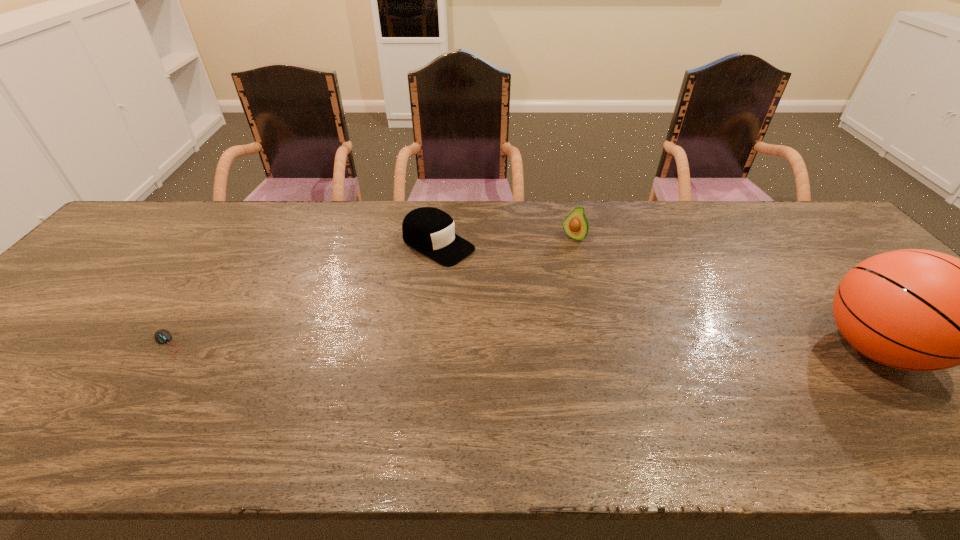
Locate an element on the screen. free space at the near right corner is located at coordinates (949, 379).

Identify the location of free space between the cap and the second tallest object. The image size is (960, 540). (506, 241).

At what (x,y) coordinates should I click in order to perform the action: click on free spot between the third shortest object and the third tallest object. Please return your answer as a coordinate pair (x, y). The image size is (960, 540). Looking at the image, I should click on (506, 241).

Where is `empty location between the avocado and the leftmost object`? empty location between the avocado and the leftmost object is located at coordinates (371, 291).

Locate an element on the screen. The height and width of the screenshot is (540, 960). free spot between the leftmost object and the cap is located at coordinates (302, 295).

Where is `vacant space that's between the second object from right to left and the leftmost object`? vacant space that's between the second object from right to left and the leftmost object is located at coordinates [x=371, y=291].

Where is `object that can be found as the second closest to the third shortest object`? The image size is (960, 540). object that can be found as the second closest to the third shortest object is located at coordinates (917, 310).

Choose which object is the nearest neighbor to the second shortest object. Please provide its 2D coordinates. Your answer should be formatted as a tuple, i.e. [(x, y)], where the tuple contains the x and y coordinates of a point satisfying the conditions above.

[(575, 225)]